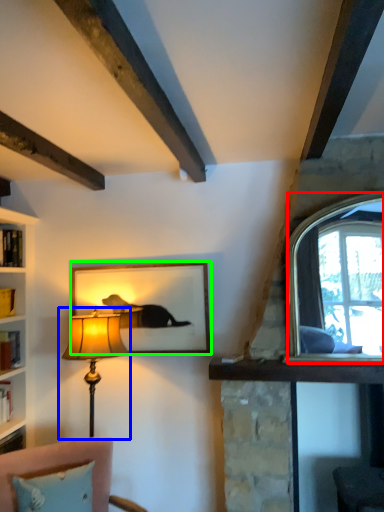
Question: Considering the real-world distances, which object is closest to window (highlighted by a red box)? lamp (highlighted by a blue box) or picture frame (highlighted by a green box).

Choices:
 (A) lamp
 (B) picture frame

Answer: (B)